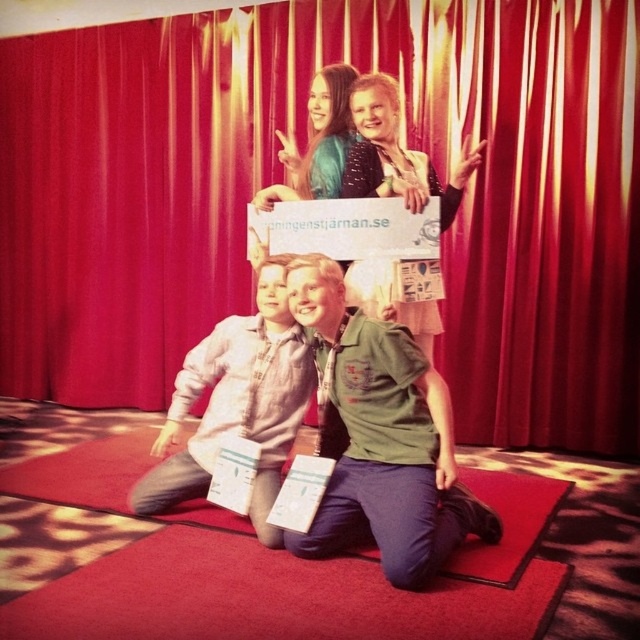
Based on the photo, you are a photographer setting up for a group photo. You need to ensure that the red velvet curtain at upper center and the light gray cotton shirt at center are both visible in the frame. Which object should you focus on first to make sure both are in the shot?

The red velvet curtain at upper center is taller than the light gray cotton shirt at center, so you should focus on the red velvet curtain at upper center first to ensure it fits within the frame, as it occupies more vertical space.

You are standing in front of the red curtain backdrop and want to place a small decorative item exactly at the point marked as point (x=282, y=179). What object is currently located at that position?

The red velvet curtain at upper center is located at point (x=282, y=179).

You are standing in front of the scene and want to locate the green uniform at center. Can you tell me its exact 2D coordinates?

The green uniform at center is located at the 2D coordinates point (x=380, y=438).